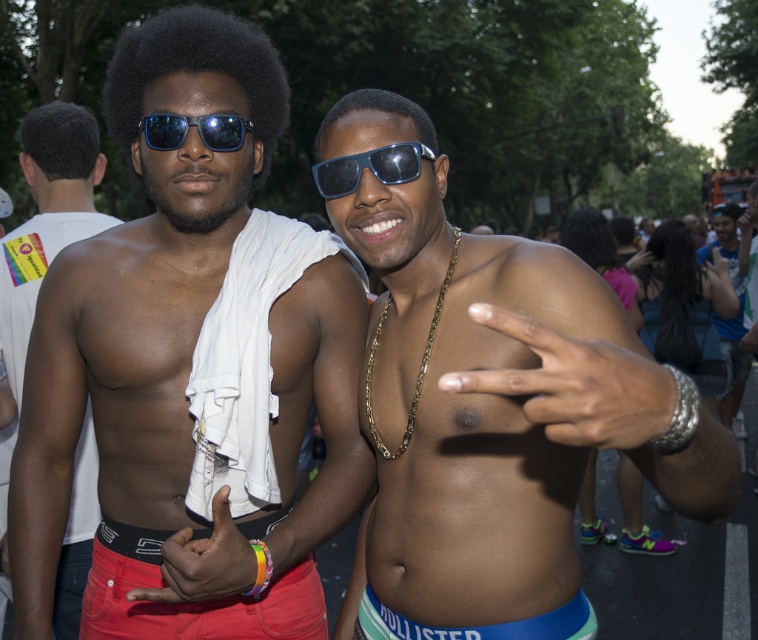
You are a photographer trying to capture a clear shot of both the dark curly hair at upper left and the blue reflective sunglasses at center. Given their sizes, which object should you focus on first to ensure it appears sharp in the photo?

The dark curly hair at upper left is bigger than the blue reflective sunglasses at center, so you should focus on the dark curly hair at upper left first to ensure it appears sharp in the photo.

You are a photographer trying to capture the two men in the scene. You want to ensure that both the dark curly hair at upper left and the blue reflective sunglasses at center are in focus. Which object should you focus on first if you want to start from the left side?

The dark curly hair at upper left is positioned on the left side of blue reflective sunglasses at center, so you should focus on the dark curly hair at upper left first.

Based on the scene description, can you determine the spatial relationship between the matte red underwear at lower left and the black matte afro at center?

Result: The matte red underwear at lower left is to the left of the black matte afro at center.